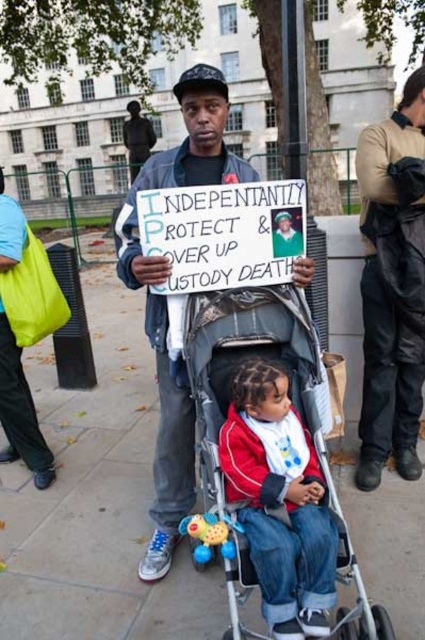
Question: Estimate the real-world distances between objects in this image. Which object is closer to the camouflage fabric stroller at center?

Choices:
 (A) matte yellow bag at left
 (B) red fleece jacket at center
 (C) dark brown leather jacket at center

Answer: (B)

Question: Based on their relative distances, which object is farther from the matte black jacket at center?

Choices:
 (A) matte yellow bag at left
 (B) dark brown leather jacket at center
 (C) red fleece jacket at center
 (D) camouflage fabric stroller at center

Answer: (B)

Question: Does red fleece jacket at center lie in front of matte black jacket at center?

Choices:
 (A) yes
 (B) no

Answer: (A)

Question: Does red fleece jacket at center appear under matte black jacket at center?

Choices:
 (A) yes
 (B) no

Answer: (A)

Question: Is gray concrete pavement at center to the left of red fleece jacket at center from the viewer's perspective?

Choices:
 (A) no
 (B) yes

Answer: (B)

Question: Which of the following is the closest to the observer?

Choices:
 (A) gray concrete pavement at center
 (B) dark brown leather jacket at center
 (C) camouflage fabric stroller at center
 (D) matte black jacket at center

Answer: (C)